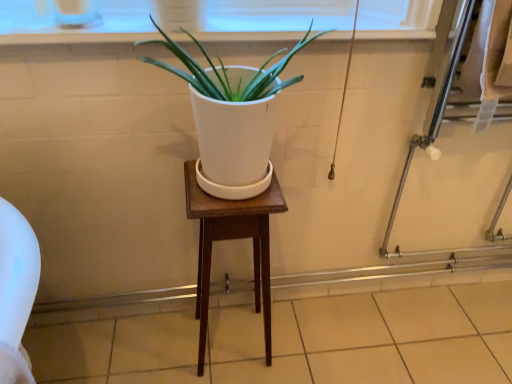
Image resolution: width=512 pixels, height=384 pixels. What are the coordinates of `white plastic window frame at upper center` in the screenshot? It's located at (270, 19).

This screenshot has width=512, height=384. Describe the element at coordinates (232, 117) in the screenshot. I see `white matte pot at center` at that location.

The height and width of the screenshot is (384, 512). I want to click on white matte pot at center, so click(232, 117).

Image resolution: width=512 pixels, height=384 pixels. Describe the element at coordinates (430, 125) in the screenshot. I see `clear glass screen door at right` at that location.

Find the location of a particular element. The width and height of the screenshot is (512, 384). beige tile at lower center is located at coordinates (296, 341).

The height and width of the screenshot is (384, 512). In order to click on wooden stool at center in this screenshot , I will do `click(232, 239)`.

Considering the sizes of objects wooden stool at center and clear glass screen door at right in the image provided, who is shorter, wooden stool at center or clear glass screen door at right?

Standing shorter between the two is wooden stool at center.

From a real-world perspective, which is physically below, wooden stool at center or clear glass screen door at right?

wooden stool at center, from a real-world perspective.

You are a GUI agent. You are given a task and a screenshot of the screen. Output one action in this format:
    pyautogui.click(x=<x>, y=<y>)
    Task: Click on the screen door behind the wooden stool at center
    This screenshot has width=512, height=384.
    Given the screenshot: What is the action you would take?
    pyautogui.click(x=430, y=125)

From the image's perspective, is wooden stool at center located above or below clear glass screen door at right?

Clearly, from the image's perspective, wooden stool at center is below clear glass screen door at right.

Looking at the image, does white matte pot at center seem bigger or smaller compared to beige tile at lower center?

Clearly, white matte pot at center is smaller in size than beige tile at lower center.

Are white matte pot at center and beige tile at lower center located far from each other?

white matte pot at center is near beige tile at lower center, not far away.

From a real-world perspective, which is physically above, white matte pot at center or beige tile at lower center?

In real-world perspective, white matte pot at center is above.

Considering the relative sizes of white matte pot at center and beige tile at lower center in the image provided, is white matte pot at center wider than beige tile at lower center?

Incorrect, the width of white matte pot at center does not surpass that of beige tile at lower center.

Is white plastic window frame at upper center positioned far away from wooden stool at center?

→ white plastic window frame at upper center is actually quite close to wooden stool at center.

Is white plastic window frame at upper center aimed at wooden stool at center?

No, white plastic window frame at upper center does not turn towards wooden stool at center.

The image size is (512, 384). Identify the location of stool behind the white plastic window frame at upper center. (232, 239).

Which of these two, white plastic window frame at upper center or wooden stool at center, stands shorter?

Standing shorter between the two is white plastic window frame at upper center.

From the image's perspective, between beige tile at lower center and wooden stool at center, which one is located above?

From the image's view, wooden stool at center is above.

How different are the orientations of beige tile at lower center and wooden stool at center in degrees?

beige tile at lower center and wooden stool at center are facing 0.355 degrees away from each other.

Is wooden stool at center surrounded by beige tile at lower center?

No, wooden stool at center is not a part of beige tile at lower center.

Which object is further away from the camera, beige tile at lower center or wooden stool at center?

beige tile at lower center is further away from the camera.

Is white matte pot at center at the left side of wooden stool at center?

No, white matte pot at center is not to the left of wooden stool at center.

From a real-world perspective, is white matte pot at center physically located above or below wooden stool at center?

white matte pot at center is situated higher than wooden stool at center in the real world.

Relative to wooden stool at center, is white matte pot at center in front or behind?

Visually, white matte pot at center is located in front of wooden stool at center.

Considering the positions of objects white matte pot at center and clear glass screen door at right in the image provided, who is more to the left, white matte pot at center or clear glass screen door at right?

From the viewer's perspective, white matte pot at center appears more on the left side.

Is white matte pot at center positioned behind clear glass screen door at right?

No, white matte pot at center is in front of clear glass screen door at right.

Which object is wider, white matte pot at center or clear glass screen door at right?

Wider between the two is white matte pot at center.

The image size is (512, 384). I want to click on window frame in front of the beige tile at lower center, so click(x=270, y=19).

Does beige tile at lower center contain white plastic window frame at upper center?

No, white plastic window frame at upper center is not a part of beige tile at lower center.

Is beige tile at lower center not near white plastic window frame at upper center?

beige tile at lower center is actually quite close to white plastic window frame at upper center.

Is beige tile at lower center oriented away from white plastic window frame at upper center?

No, beige tile at lower center is not facing the opposite direction of white plastic window frame at upper center.

At what (x,y) coordinates should I click in order to perform the action: click on stool on the left of clear glass screen door at right. Please return your answer as a coordinate pair (x, y). Image resolution: width=512 pixels, height=384 pixels. Looking at the image, I should click on (232, 239).

Locate an element on the screen. The width and height of the screenshot is (512, 384). tile that appears on the right of white matte pot at center is located at coordinates (296, 341).

Considering their positions, is white plastic window frame at upper center positioned further to wooden stool at center than clear glass screen door at right?

Based on the image, clear glass screen door at right appears to be further to wooden stool at center.

Consider the image. Considering their positions, is clear glass screen door at right positioned further to white plastic window frame at upper center than white matte pot at center?

The object further to white plastic window frame at upper center is clear glass screen door at right.

Based on their spatial positions, is white plastic window frame at upper center or white matte pot at center further from clear glass screen door at right?

Among the two, white matte pot at center is located further to clear glass screen door at right.

When comparing their distances from white matte pot at center, does white plastic window frame at upper center or clear glass screen door at right seem closer?

white plastic window frame at upper center lies closer to white matte pot at center than the other object.

Estimate the real-world distances between objects in this image. Which object is closer to beige tile at lower center, white matte pot at center or wooden stool at center?

wooden stool at center lies closer to beige tile at lower center than the other object.

Which object lies nearer to the anchor point beige tile at lower center, white matte pot at center or white plastic window frame at upper center?

white matte pot at center is closer to beige tile at lower center.

Consider the image. Which object lies further to the anchor point wooden stool at center, white plastic window frame at upper center or beige tile at lower center?

Based on the image, white plastic window frame at upper center appears to be further to wooden stool at center.

Looking at the image, which one is located closer to white matte pot at center, clear glass screen door at right or wooden stool at center?

wooden stool at center lies closer to white matte pot at center than the other object.

I want to click on stool situated between white plastic window frame at upper center and clear glass screen door at right from left to right, so click(232, 239).

You are a GUI agent. You are given a task and a screenshot of the screen. Output one action in this format:
    pyautogui.click(x=<x>, y=<y>)
    Task: Click on the stool that lies between white matte pot at center and beige tile at lower center from top to bottom
    This screenshot has width=512, height=384.
    Given the screenshot: What is the action you would take?
    click(x=232, y=239)

Identify the location of houseplant between white plastic window frame at upper center and clear glass screen door at right from left to right. (232, 117).

At what (x,y) coordinates should I click in order to perform the action: click on tile between wooden stool at center and clear glass screen door at right from left to right. Please return your answer as a coordinate pair (x, y). The width and height of the screenshot is (512, 384). Looking at the image, I should click on (296, 341).